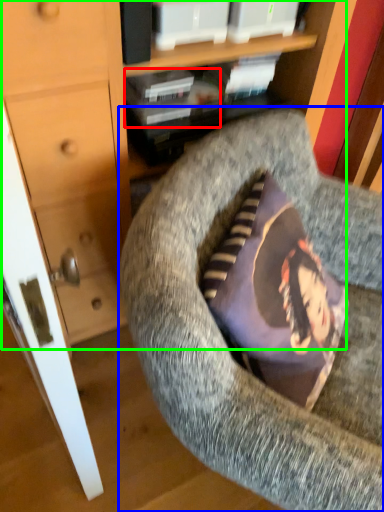
Question: Considering the real-world distances, which object is closest to book (highlighted by a red box)? chair (highlighted by a blue box) or dresser (highlighted by a green box).

Choices:
 (A) chair
 (B) dresser

Answer: (B)